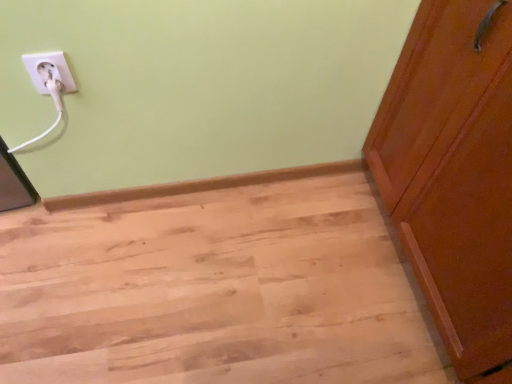
The width and height of the screenshot is (512, 384). What do you see at coordinates (52, 71) in the screenshot?
I see `white plastic socket at upper left` at bounding box center [52, 71].

This screenshot has height=384, width=512. Identify the location of white plastic socket at upper left. (52, 71).

Locate an element on the screen. white plastic socket at upper left is located at coordinates (52, 71).